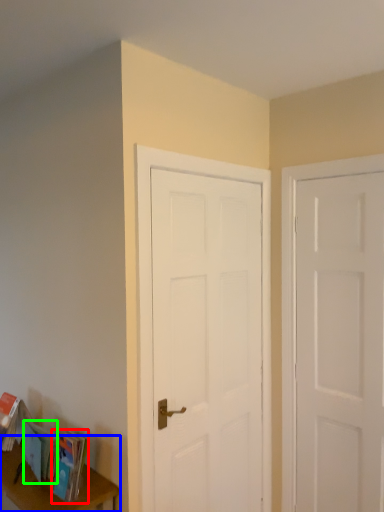
Question: Which object is the closest to the paperback book (highlighted by a red box)? Choose among these: table (highlighted by a blue box) or book (highlighted by a green box).

Choices:
 (A) table
 (B) book

Answer: (B)